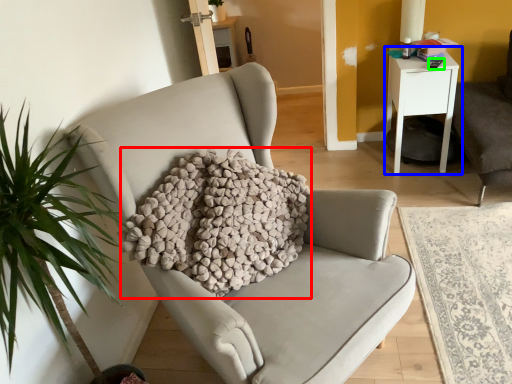
Question: Estimate the real-world distances between objects in this image. Which object is closer to pillow (highlighted by a red box), nightstand (highlighted by a blue box) or remote control (highlighted by a green box)?

Choices:
 (A) nightstand
 (B) remote control

Answer: (A)